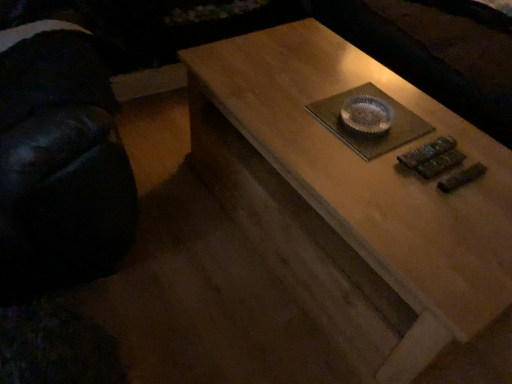
Question: From the image's perspective, is wooden coffee table at center positioned above or below black fabric swivel chair at left?

Choices:
 (A) above
 (B) below

Answer: (B)

Question: Is point (403, 238) closer or farther from the camera than point (74, 195)?

Choices:
 (A) closer
 (B) farther

Answer: (A)

Question: Considering the positions of wooden coffee table at center and black fabric swivel chair at left in the image, is wooden coffee table at center taller or shorter than black fabric swivel chair at left?

Choices:
 (A) short
 (B) tall

Answer: (A)

Question: From a real-world perspective, is black fabric swivel chair at left above or below wooden coffee table at center?

Choices:
 (A) above
 (B) below

Answer: (A)

Question: In terms of size, does black fabric swivel chair at left appear bigger or smaller than wooden coffee table at center?

Choices:
 (A) small
 (B) big

Answer: (B)

Question: Is black fabric swivel chair at left in front of or behind wooden coffee table at center in the image?

Choices:
 (A) behind
 (B) front

Answer: (B)

Question: Is point (25, 39) positioned closer to the camera than point (201, 175)?

Choices:
 (A) closer
 (B) farther

Answer: (A)